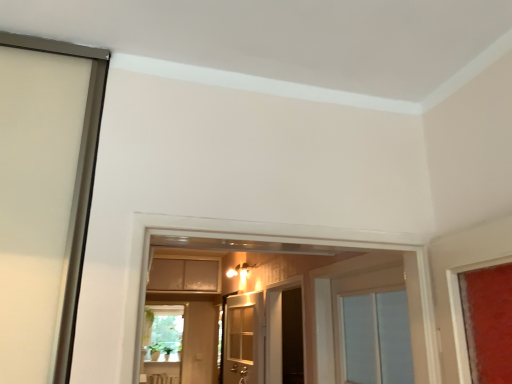
Question: Is white wooden door at center at the left side of dark wood screen door at center?

Choices:
 (A) no
 (B) yes

Answer: (B)

Question: Is the position of white wooden door at center less distant than that of dark wood screen door at center?

Choices:
 (A) yes
 (B) no

Answer: (A)

Question: Is white wooden door at center positioned with its back to dark wood screen door at center?

Choices:
 (A) no
 (B) yes

Answer: (B)

Question: From the image's perspective, is white wooden door at center above dark wood screen door at center?

Choices:
 (A) yes
 (B) no

Answer: (A)

Question: Is white wooden door at center surrounding dark wood screen door at center?

Choices:
 (A) no
 (B) yes

Answer: (A)

Question: Is white wooden door at center not within dark wood screen door at center?

Choices:
 (A) yes
 (B) no

Answer: (A)

Question: From the image's perspective, is dark wood screen door at center above matte beige cabinet at center?

Choices:
 (A) yes
 (B) no

Answer: (B)

Question: Does dark wood screen door at center lie in front of matte beige cabinet at center?

Choices:
 (A) no
 (B) yes

Answer: (B)

Question: Can you confirm if dark wood screen door at center is smaller than matte beige cabinet at center?

Choices:
 (A) yes
 (B) no

Answer: (A)

Question: Is dark wood screen door at center not close to matte beige cabinet at center?

Choices:
 (A) no
 (B) yes

Answer: (B)

Question: Does dark wood screen door at center have a larger size compared to matte beige cabinet at center?

Choices:
 (A) yes
 (B) no

Answer: (B)

Question: Is dark wood screen door at center further to the viewer compared to matte beige cabinet at center?

Choices:
 (A) yes
 (B) no

Answer: (B)

Question: From a real-world perspective, is dark wood screen door at center below white wooden door at center?

Choices:
 (A) no
 (B) yes

Answer: (A)